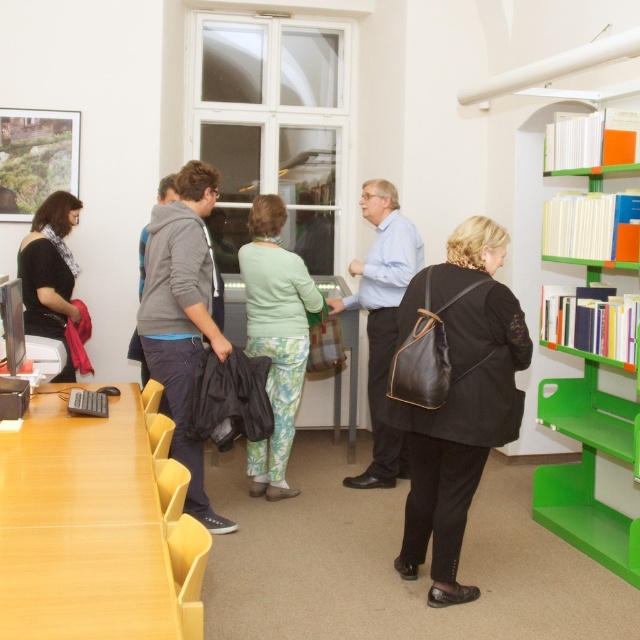
You are standing in the library and see the gray hoodie at center. Can you estimate its position relative to the bookshelves on the right side of the frame?

The gray hoodie at center is located at point (182, 317), which places it centrally in the image, closer to the center than the bookshelves on the right side. Therefore, the gray hoodie at center is positioned to the left of the bookshelves on the right side of the frame.

You are standing in the library and see two items at the center of the image. One is the green floral pants at center and the other is the gray fleece jacket at center. Which item is positioned to the right of the other?

The green floral pants at center are to the right of the gray fleece jacket at center.

You are standing in the library and notice a person wearing green floral pants at center. Can you determine their exact position in the room based on the coordinates provided?

The green floral pants at center is located at point (275,337), which means the person is positioned near the center of the room both horizontally and vertically.